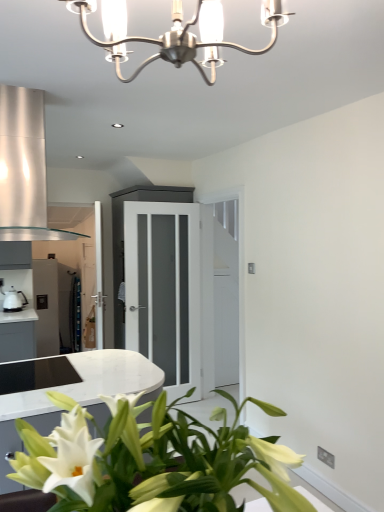
Question: Based on their sizes in the image, would you say satin silver exhaust hood at upper left is bigger or smaller than white glossy houseplant at lower left?

Choices:
 (A) big
 (B) small

Answer: (B)

Question: Based on their positions, is satin silver exhaust hood at upper left located to the left or right of white glossy houseplant at lower left?

Choices:
 (A) left
 (B) right

Answer: (A)

Question: Which of these objects is positioned closest to the white glossy kettle at left?

Choices:
 (A) brushed metal chandelier at upper center
 (B) satin silver exhaust hood at upper left
 (C) white frosted glass door at center
 (D) white glossy houseplant at lower left

Answer: (C)

Question: Based on their relative distances, which object is nearer to the satin silver exhaust hood at upper left?

Choices:
 (A) white frosted glass door at center
 (B) white glossy houseplant at lower left
 (C) brushed metal chandelier at upper center
 (D) white glossy kettle at left

Answer: (C)